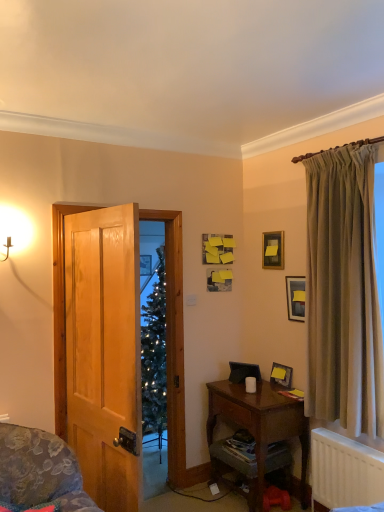
Question: Does wooden picture frame at upper center, placed as the third picture frame when sorted from bottom to top, lie behind wooden cabinet at lower right?

Choices:
 (A) yes
 (B) no

Answer: (A)

Question: Is the surface of wooden picture frame at upper center, which is counted as the 1th picture frame, starting from the top, in direct contact with wooden cabinet at lower right?

Choices:
 (A) yes
 (B) no

Answer: (B)

Question: Considering the relative sizes of wooden picture frame at upper center, placed as the third picture frame when sorted from bottom to top, and wooden cabinet at lower right in the image provided, is wooden picture frame at upper center, placed as the third picture frame when sorted from bottom to top, bigger than wooden cabinet at lower right?

Choices:
 (A) yes
 (B) no

Answer: (B)

Question: Could wooden cabinet at lower right be considered to be inside wooden picture frame at upper center, which is counted as the 1th picture frame, starting from the top?

Choices:
 (A) no
 (B) yes

Answer: (A)

Question: Can you confirm if wooden picture frame at upper center, which is counted as the 1th picture frame, starting from the top, is shorter than wooden cabinet at lower right?

Choices:
 (A) yes
 (B) no

Answer: (A)

Question: Is point (238, 394) closer or farther from the camera than point (256, 386)?

Choices:
 (A) closer
 (B) farther

Answer: (A)

Question: Based on their sizes in the image, would you say wooden desk at lower right is bigger or smaller than white matte coffee cup at lower center?

Choices:
 (A) small
 (B) big

Answer: (B)

Question: From a real-world perspective, is wooden desk at lower right above or below white matte coffee cup at lower center?

Choices:
 (A) above
 (B) below

Answer: (B)

Question: From the image's perspective, is wooden desk at lower right located above or below white matte coffee cup at lower center?

Choices:
 (A) below
 (B) above

Answer: (A)

Question: Is white plastic radiator at lower right in front of or behind matte black picture frame at upper center, placed as the second picture frame when sorted from top to bottom, in the image?

Choices:
 (A) behind
 (B) front

Answer: (B)

Question: Is white plastic radiator at lower right bigger or smaller than matte black picture frame at upper center, which is the 2th picture frame from bottom to top?

Choices:
 (A) big
 (B) small

Answer: (A)

Question: From the image's perspective, relative to matte black picture frame at upper center, placed as the second picture frame when sorted from top to bottom, is white plastic radiator at lower right above or below?

Choices:
 (A) above
 (B) below

Answer: (B)

Question: Is white plastic radiator at lower right wider or thinner than matte black picture frame at upper center, which is the 2th picture frame from bottom to top?

Choices:
 (A) thin
 (B) wide

Answer: (B)

Question: Considering the positions of silky beige curtain at right and wooden picture frame at upper center, placed as the third picture frame when sorted from bottom to top, in the image, is silky beige curtain at right taller or shorter than wooden picture frame at upper center, placed as the third picture frame when sorted from bottom to top,?

Choices:
 (A) tall
 (B) short

Answer: (A)

Question: In terms of width, does silky beige curtain at right look wider or thinner when compared to wooden picture frame at upper center, placed as the third picture frame when sorted from bottom to top?

Choices:
 (A) wide
 (B) thin

Answer: (A)